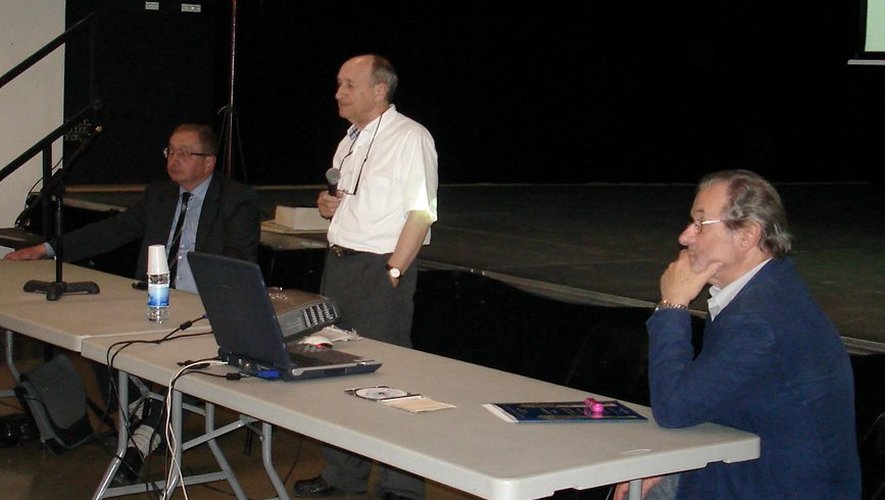
You are a GUI agent. You are given a task and a screenshot of the screen. Output one action in this format:
    pyautogui.click(x=<x>, y=<y>)
    Task: Click on the magazine
    
    Given the screenshot: What is the action you would take?
    pyautogui.click(x=555, y=414)